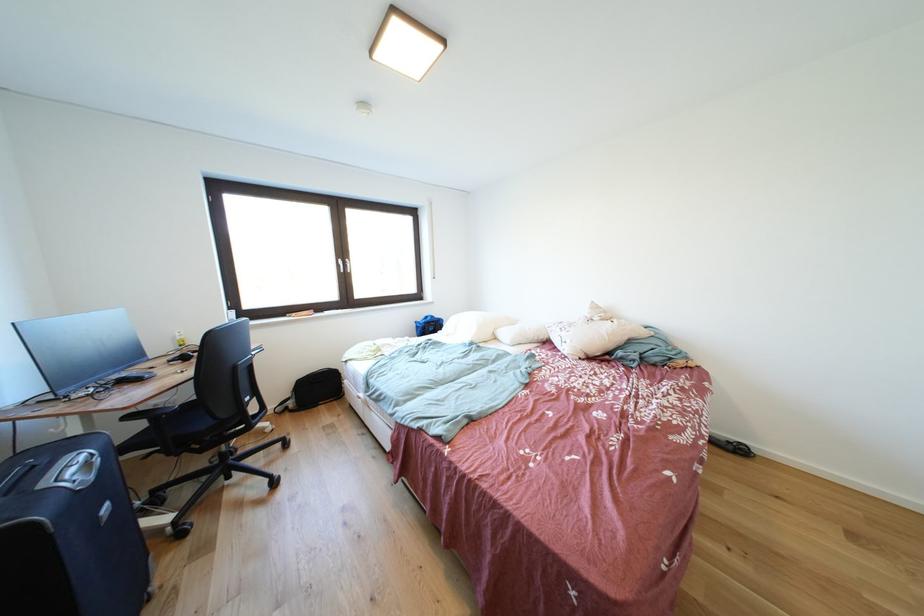
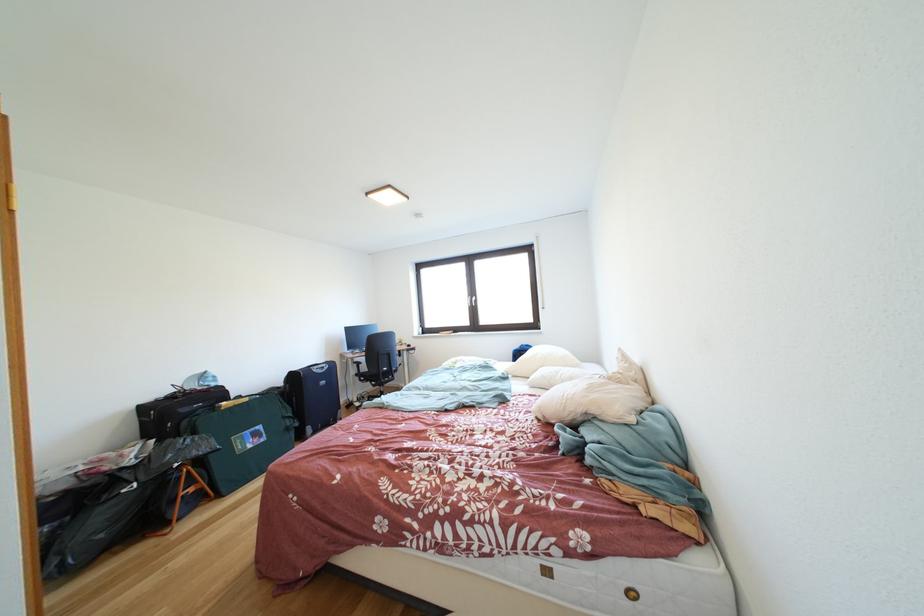
Find the pixel in the second image that matches (x=441, y=321) in the first image.

(535, 351)